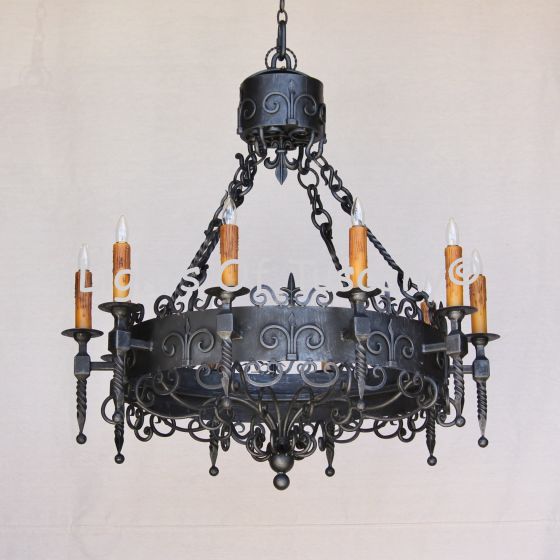
In order to click on candles in this screenshot , I will do `click(121, 261)`, `click(79, 300)`, `click(230, 252)`, `click(359, 258)`, `click(457, 286)`, `click(479, 306)`.